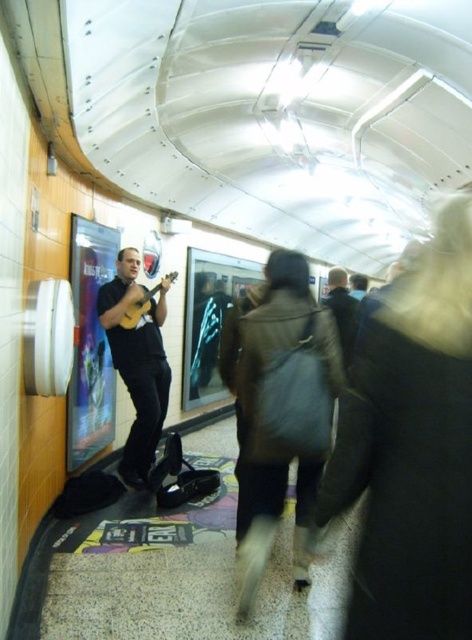
Question: Is matte black ukulele at left to the right of dark brown leather jacket at center from the viewer's perspective?

Choices:
 (A) yes
 (B) no

Answer: (B)

Question: Which of the following is the closest to the observer?

Choices:
 (A) (132, 348)
 (B) (344, 307)

Answer: (A)

Question: Is matte black ukulele at left in front of yellow matte guitar at left?

Choices:
 (A) no
 (B) yes

Answer: (B)

Question: Does dark brown leather jacket at center lie behind yellow matte guitar at left?

Choices:
 (A) no
 (B) yes

Answer: (A)

Question: Which point is farther from the camera taking this photo?

Choices:
 (A) pyautogui.click(x=103, y=308)
 (B) pyautogui.click(x=337, y=288)

Answer: (B)

Question: Among these points, which one is nearest to the camera?

Choices:
 (A) (121, 454)
 (B) (331, 269)
 (C) (159, 284)

Answer: (A)